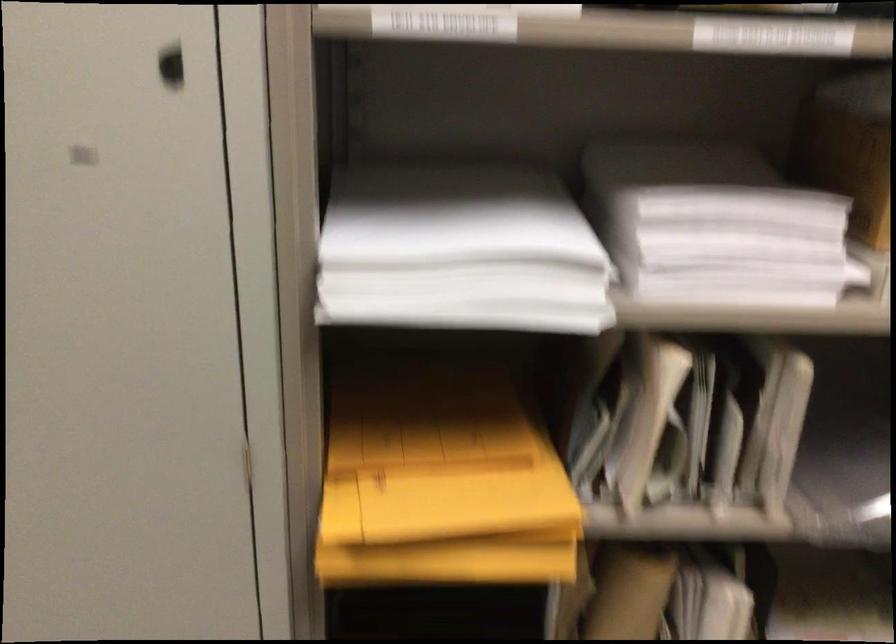
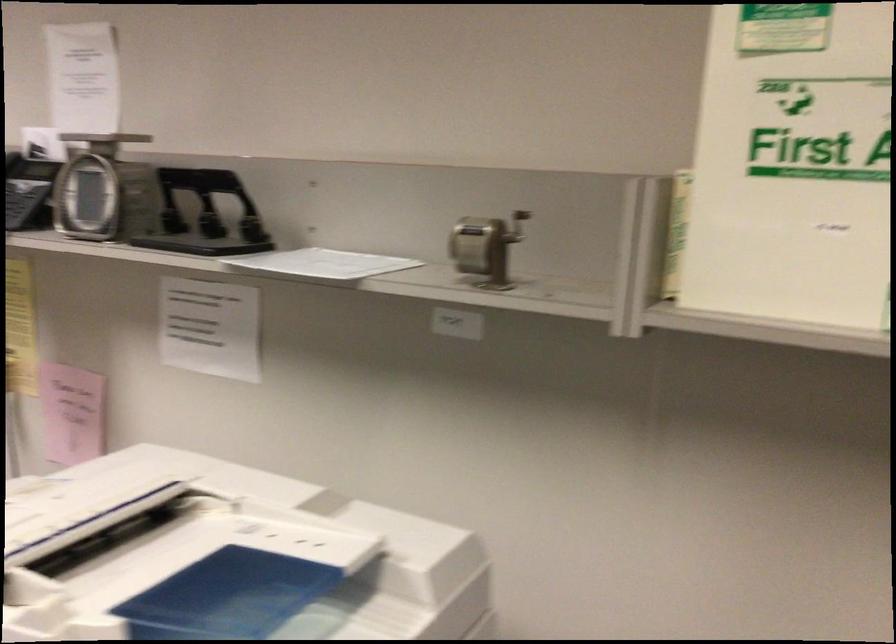
Question: The images are taken continuously from a first-person perspective. In which direction are you moving?

Choices:
 (A) Left
 (B) Right
 (C) Forward
 (D) Backward

Answer: (D)